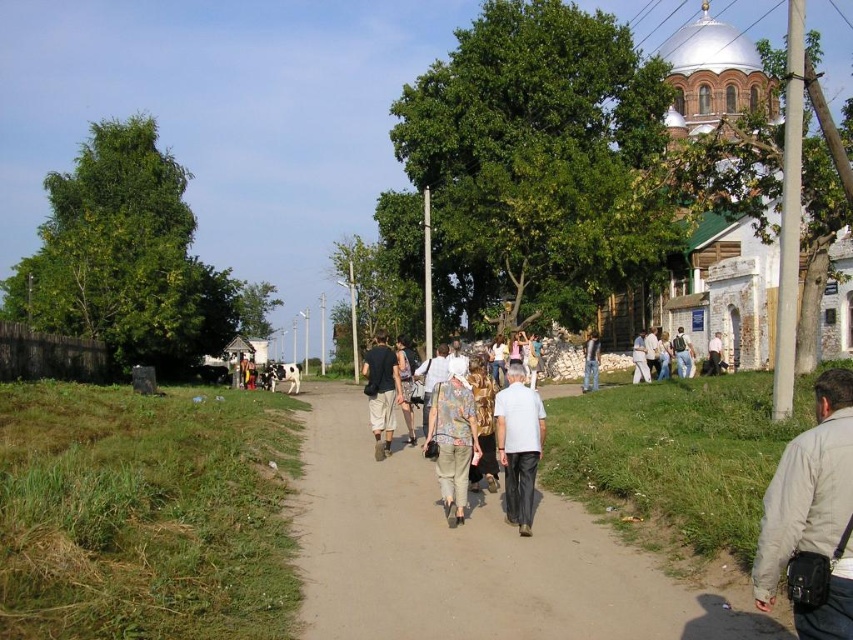
You are a traveler standing on the dirt path and you want to take a photo of the white stone church at right and the light brown leather jacket at center. Which object should you zoom in more on to capture both in the frame?

You should zoom in more on the light brown leather jacket at center because the white stone church at right is larger in size, so zooming in on the smaller object will help both fit in the frame.